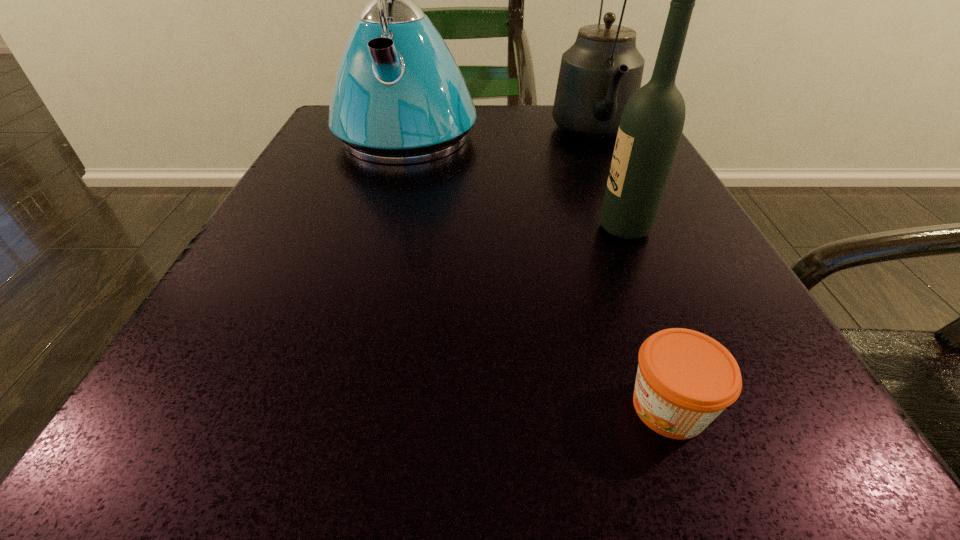
Where is `free location located 0.380m on the labeled side of the wine bottle`? The height and width of the screenshot is (540, 960). free location located 0.380m on the labeled side of the wine bottle is located at coordinates (341, 228).

Identify the location of vacant space located on the front label of the jam. (522, 407).

Where is `vacant space situated on the front label of the jam`? vacant space situated on the front label of the jam is located at coordinates (328, 407).

Identify the location of vacant point located 0.110m on the front label of the jam. (513, 407).

At what (x,y) coordinates should I click in order to perform the action: click on object that is at the near edge. Please return your answer as a coordinate pair (x, y). Image resolution: width=960 pixels, height=540 pixels. Looking at the image, I should click on (685, 379).

The image size is (960, 540). In order to click on object at the left edge in this screenshot , I will do `click(399, 97)`.

Locate an element on the screen. The width and height of the screenshot is (960, 540). kettle that is at the right edge is located at coordinates (599, 73).

Find the location of a particular element. This screenshot has width=960, height=540. wine bottle that is at the right edge is located at coordinates (651, 126).

At what (x,y) coordinates should I click in order to perform the action: click on jam that is positioned at the right edge. Please return your answer as a coordinate pair (x, y). The width and height of the screenshot is (960, 540). Looking at the image, I should click on pos(685,379).

At what (x,y) coordinates should I click in order to perform the action: click on object positioned at the far left corner. Please return your answer as a coordinate pair (x, y). The height and width of the screenshot is (540, 960). Looking at the image, I should click on (399, 97).